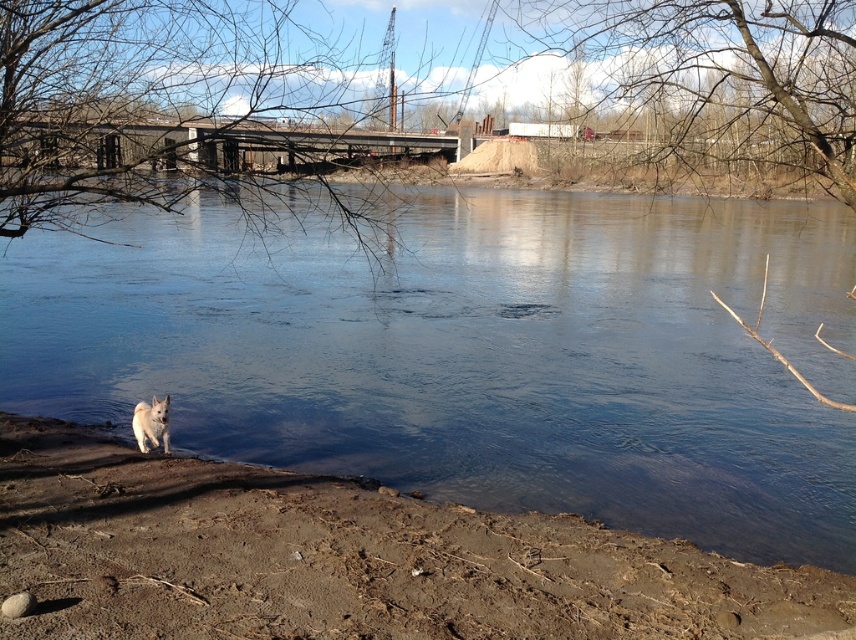
Based on the photo, who is higher up, clear water at lower left or brown dirt at lower left?

clear water at lower left is higher up.

Is point (666, 474) in front of point (325, 563)?

No.

You are a GUI agent. You are given a task and a screenshot of the screen. Output one action in this format:
    pyautogui.click(x=<x>, y=<y>)
    Task: Click on the clear water at lower left
    Image resolution: width=856 pixels, height=640 pixels.
    Given the screenshot: What is the action you would take?
    pyautogui.click(x=477, y=353)

Is clear water at lower left positioned before white fluffy dog at lower left?

That is True.

This screenshot has width=856, height=640. In order to click on clear water at lower left in this screenshot , I will do `click(477, 353)`.

Identify the location of clear water at lower left. Image resolution: width=856 pixels, height=640 pixels. (477, 353).

Measure the distance between brown dirt at lower left and white fluffy dog at lower left.

The distance of brown dirt at lower left from white fluffy dog at lower left is 9.25 feet.

Is brown dirt at lower left positioned behind white fluffy dog at lower left?

No, brown dirt at lower left is in front of white fluffy dog at lower left.

Which is in front, point (64, 481) or point (140, 403)?

Point (64, 481)

At what (x,y) coordinates should I click in order to perform the action: click on brown dirt at lower left. Please return your answer as a coordinate pair (x, y). Looking at the image, I should click on (346, 560).